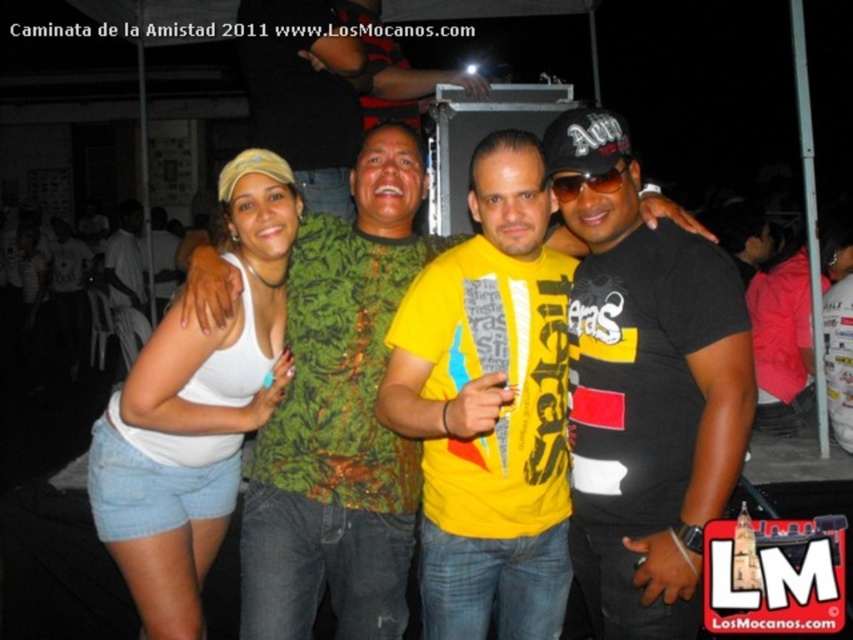
Based on the photo, between black matte t-shirt at center and white fabric tank top at left, which one appears on the left side from the viewer's perspective?

white fabric tank top at left is more to the left.

Can you confirm if black matte t-shirt at center is positioned to the left of white fabric tank top at left?

Incorrect, black matte t-shirt at center is not on the left side of white fabric tank top at left.

Does point (619, 420) lie behind point (225, 412)?

No, (619, 420) is in front of (225, 412).

Find the location of `black matte t-shirt at center`. black matte t-shirt at center is located at coordinates (643, 387).

Can you confirm if black matte t-shirt at center is taller than white fabric tank top at center?

Correct, black matte t-shirt at center is much taller as white fabric tank top at center.

Where is `black matte t-shirt at center`? black matte t-shirt at center is located at coordinates (643, 387).

Who is lower down, yellow printed t-shirt at center or white fabric tank top at left?

white fabric tank top at left is lower down.

Is yellow printed t-shirt at center closer to camera compared to white fabric tank top at left?

Yes, yellow printed t-shirt at center is closer to the viewer.

Which is behind, point (544, 488) or point (227, 177)?

Positioned behind is point (544, 488).

Where is `yellow printed t-shirt at center`? The image size is (853, 640). yellow printed t-shirt at center is located at coordinates (489, 410).